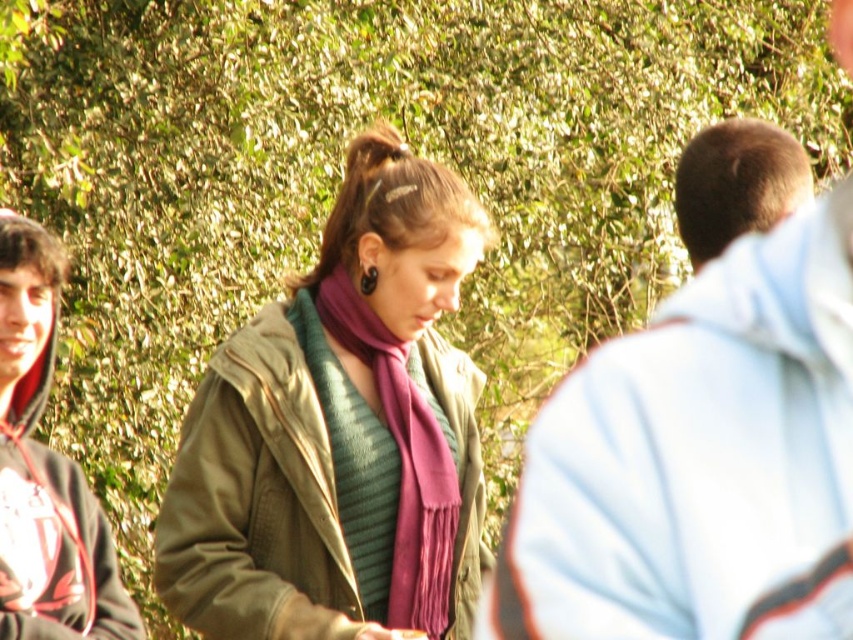
Question: Is light blue hoodie at right in front of brown hair at right?

Choices:
 (A) yes
 (B) no

Answer: (A)

Question: In this image, where is light blue hoodie at right located relative to matte green jacket at center?

Choices:
 (A) left
 (B) right

Answer: (B)

Question: Which point appears closest to the camera in this image?

Choices:
 (A) (756, 179)
 (B) (432, 456)
 (C) (55, 547)

Answer: (A)

Question: Based on their relative distances, which object is farther from the matte green jacket at center?

Choices:
 (A) brown hair at right
 (B) purple silky scarf at center
 (C) dark gray hoodie at left

Answer: (A)

Question: Estimate the real-world distances between objects in this image. Which object is farther from the light blue hoodie at right?

Choices:
 (A) dark gray hoodie at left
 (B) brown hair at right
 (C) purple silky scarf at center
 (D) matte green jacket at center

Answer: (A)

Question: Can you confirm if matte green jacket at center is smaller than dark gray hoodie at left?

Choices:
 (A) yes
 (B) no

Answer: (B)